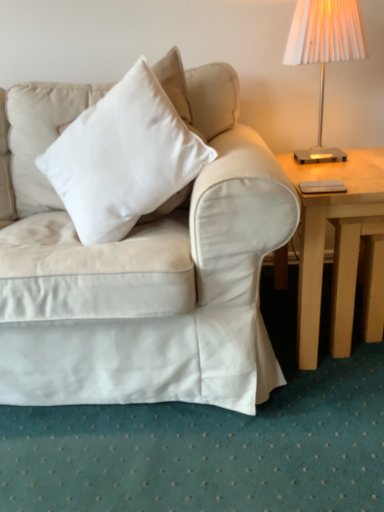
Question: Is point (167, 174) closer or farther from the camera than point (311, 214)?

Choices:
 (A) closer
 (B) farther

Answer: (B)

Question: From the image's perspective, relative to light wood table at right, is white soft cushion at upper left above or below?

Choices:
 (A) below
 (B) above

Answer: (B)

Question: Considering the real-world distances, which object is farthest from the metallic silver lampshade at upper right?

Choices:
 (A) light wood table at right
 (B) satin white couch at center
 (C) white soft cushion at upper left

Answer: (B)

Question: Based on their relative distances, which object is farther from the light wood table at right?

Choices:
 (A) white soft cushion at upper left
 (B) metallic silver lampshade at upper right
 (C) satin white couch at center

Answer: (B)